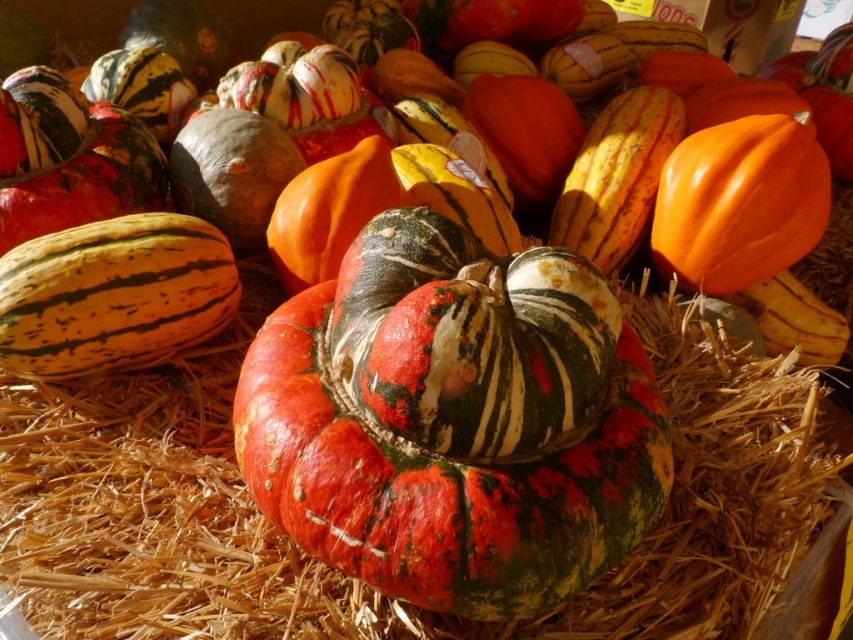
What is located at the point with coordinates (358,580) in the image?

The point at coordinates (358,580) is where the textured straw at center is located.

You are a farmer organizing a harvest display. You have a textured straw at center and a speckled orange and green gourd at center. You need to place a decorative ribbon between them. What is the minimum length of ribbon required to stretch between the two items?

The textured straw at center and the speckled orange and green gourd at center are 8.41 inches apart, so the minimum length of ribbon required to stretch between them is 8.41 inches.